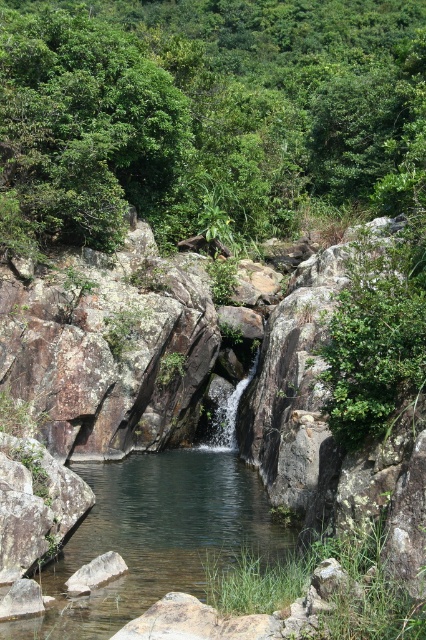
You are a hiker trying to cross the clear water stream at center. There is a green leafy tree at upper center nearby. Can you use the tree to help you cross the stream safely?

The green leafy tree at upper center might be wider than the clear water stream at center, so it could potentially provide support or a bridge to help you cross safely.

In the scene shown: You are a hiker who wants to cross the clear water stream at center. You have a 30 meter rope. Can you use the green leafy tree at upper center to secure the rope for crossing?

The green leafy tree at upper center is 36.87 meters from the clear water stream at center. Since the rope is only 30 meters long, it is not long enough to reach from the tree to the stream. You cannot secure the rope for crossing.

Consider the image. You are standing at the edge of the pool in the image. There is a point marked at coordinates (206, 115). What object is located at that point?

The green leafy tree at upper center is located at point (206, 115).